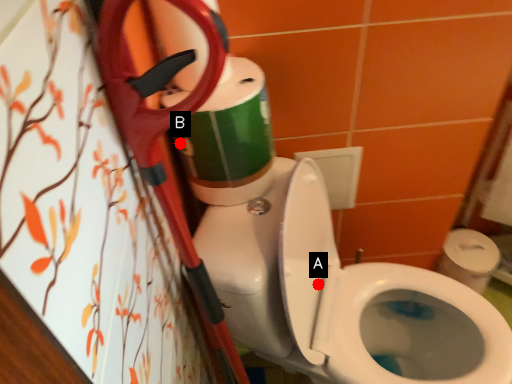
Question: Two points are circled on the image, labeled by A and B beside each circle. Which of the following is the farthest from the observer?

Choices:
 (A) A is further
 (B) B is further

Answer: (A)